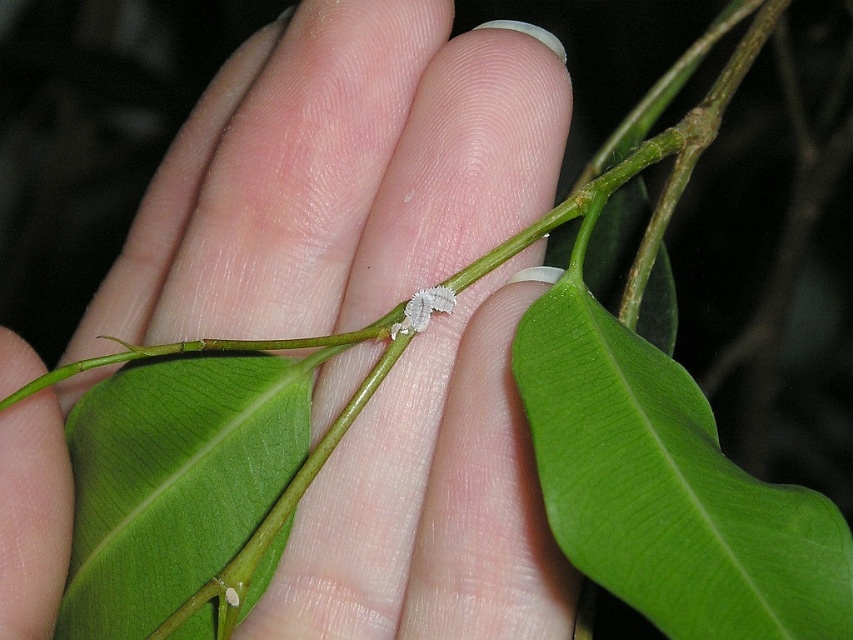
Does white matte leaf at center have a greater width compared to green smooth leaf at center?

Indeed, white matte leaf at center has a greater width compared to green smooth leaf at center.

Can you confirm if white matte leaf at center is bigger than green smooth leaf at center?

Indeed, white matte leaf at center has a larger size compared to green smooth leaf at center.

Is point (428, 410) less distant than point (643, 468)?

No, it is behind (643, 468).

This screenshot has width=853, height=640. What are the coordinates of `white matte leaf at center` in the screenshot? It's located at (335, 176).

Is green smooth leaf at center taller than white fuzzy caterpillar at center?

Indeed, green smooth leaf at center has a greater height compared to white fuzzy caterpillar at center.

In the scene shown: Which is more to the right, green smooth leaf at center or white fuzzy caterpillar at center?

green smooth leaf at center is more to the right.

Is point (608, 362) in front of point (403, 330)?

Yes, point (608, 362) is closer to viewer.

Where is `green smooth leaf at center`? The height and width of the screenshot is (640, 853). green smooth leaf at center is located at coordinates (666, 488).

Does point (556, 483) lie behind point (97, 538)?

That is False.

Does green smooth leaf at center have a smaller size compared to green matte leaf at center?

Incorrect, green smooth leaf at center is not smaller in size than green matte leaf at center.

Is point (635, 602) positioned after point (160, 445)?

No, it is not.

Where is `green smooth leaf at center`? The image size is (853, 640). green smooth leaf at center is located at coordinates (666, 488).